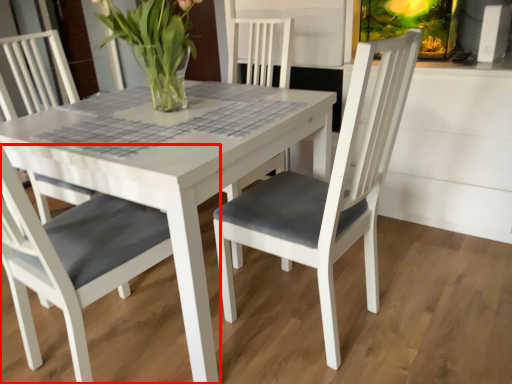
Question: From the image's perspective, what is the correct spatial relationship of chair (annotated by the red box) in relation to houseplant?

Choices:
 (A) below
 (B) above

Answer: (A)